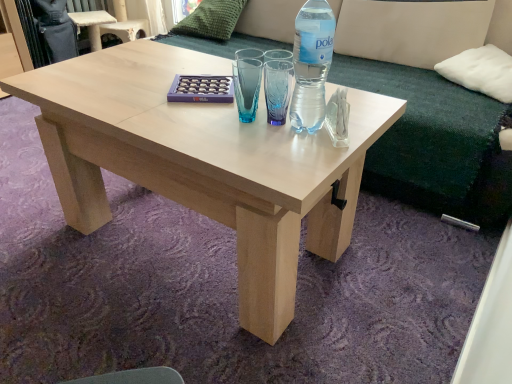
This screenshot has height=384, width=512. What are the coordinates of `white soft cushion at upper right, the first pillow positioned from the front` in the screenshot? It's located at (481, 71).

At what (x,y) coordinates should I click in order to perform the action: click on natural wood coffee table at center. Please return your answer as a coordinate pair (x, y). Looking at the image, I should click on (203, 162).

Identify the location of green textured pillow at upper center, the second pillow positioned from the front. (211, 20).

Describe the element at coordinates (435, 143) in the screenshot. I see `beige fabric couch at upper center` at that location.

This screenshot has height=384, width=512. What do you see at coordinates (311, 64) in the screenshot?
I see `clear plastic bottle at center` at bounding box center [311, 64].

Where is `clear plastic bottle at center`? This screenshot has width=512, height=384. clear plastic bottle at center is located at coordinates (311, 64).

This screenshot has width=512, height=384. Identify the location of white soft cushion at upper right, the 2th pillow positioned from the top. (481, 71).

Would you say clear plastic bottle at center is outside white soft cushion at upper right, the first pillow positioned from the front?

Absolutely, clear plastic bottle at center is external to white soft cushion at upper right, the first pillow positioned from the front.

Is clear plastic bottle at center bigger than white soft cushion at upper right, acting as the first pillow starting from the bottom?

Actually, clear plastic bottle at center might be smaller than white soft cushion at upper right, acting as the first pillow starting from the bottom.

From the image's perspective, relative to white soft cushion at upper right, which appears as the 1th pillow when viewed from the right, is clear plastic bottle at center above or below?

Clearly, from the image's perspective, clear plastic bottle at center is below white soft cushion at upper right, which appears as the 1th pillow when viewed from the right.

From the image's perspective, does beige fabric couch at upper center appear higher than white soft cushion at upper right, the 2th pillow positioned from the top?

Yes, from the image's perspective, beige fabric couch at upper center is on top of white soft cushion at upper right, the 2th pillow positioned from the top.

Can white soft cushion at upper right, which is the 2th pillow in left-to-right order, be found inside beige fabric couch at upper center?

Absolutely, white soft cushion at upper right, which is the 2th pillow in left-to-right order, is inside beige fabric couch at upper center.

Would you say beige fabric couch at upper center is to the left or to the right of white soft cushion at upper right, the 2th pillow positioned from the top, in the picture?

Clearly, beige fabric couch at upper center is on the left of white soft cushion at upper right, the 2th pillow positioned from the top, in the image.

Considering the positions of objects clear plastic bottle at center and green textured pillow at upper center, the second pillow positioned from the front, in the image provided, who is more to the right, clear plastic bottle at center or green textured pillow at upper center, the second pillow positioned from the front,?

Positioned to the right is clear plastic bottle at center.

Between clear plastic bottle at center and green textured pillow at upper center, the 1th pillow positioned from the back, which one has larger size?

green textured pillow at upper center, the 1th pillow positioned from the back.

Looking at their sizes, would you say clear plastic bottle at center is wider or thinner than green textured pillow at upper center, the 1th pillow positioned from the back?

Considering their sizes, clear plastic bottle at center looks slimmer than green textured pillow at upper center, the 1th pillow positioned from the back.

Is point (295, 130) positioned behind point (232, 32)?

No, (295, 130) is closer to viewer.

This screenshot has width=512, height=384. Find the location of `couch on the right of green textured pillow at upper center, the 1th pillow positioned from the back`. couch on the right of green textured pillow at upper center, the 1th pillow positioned from the back is located at coordinates [x=435, y=143].

How distant is green textured pillow at upper center, the 1th pillow positioned from the back, from beige fabric couch at upper center?

They are 39.10 inches apart.

Would you consider green textured pillow at upper center, the 2th pillow in the bottom-to-top sequence, to be distant from beige fabric couch at upper center?

Actually, green textured pillow at upper center, the 2th pillow in the bottom-to-top sequence, and beige fabric couch at upper center are a little close together.

In the scene shown: Between green textured pillow at upper center, arranged as the second pillow when viewed from the right, and beige fabric couch at upper center, which one has larger width?

Result: With larger width is beige fabric couch at upper center.

Does point (398, 150) come behind point (189, 192)?

Yes, it is behind point (189, 192).

Between beige fabric couch at upper center and natural wood coffee table at center, which one is positioned in front?

natural wood coffee table at center is closer to the camera.

Between beige fabric couch at upper center and natural wood coffee table at center, which one has smaller width?

Thinner between the two is beige fabric couch at upper center.

How different are the orientations of beige fabric couch at upper center and natural wood coffee table at center in degrees?

The facing directions of beige fabric couch at upper center and natural wood coffee table at center are 0.361 degrees apart.

From the image's perspective, which object appears higher, clear plastic bottle at center or natural wood coffee table at center?

From the image's view, clear plastic bottle at center is above.

Is the position of clear plastic bottle at center less distant than that of natural wood coffee table at center?

No, it is not.

Is the surface of clear plastic bottle at center in direct contact with natural wood coffee table at center?

No, clear plastic bottle at center is not with natural wood coffee table at center.

At what (x,y) coordinates should I click in order to perform the action: click on couch that appears on the right of green textured pillow at upper center, arranged as the second pillow when viewed from the right. Please return your answer as a coordinate pair (x, y). This screenshot has height=384, width=512. Looking at the image, I should click on (435, 143).

Does beige fabric couch at upper center lie in front of green textured pillow at upper center, arranged as the second pillow when viewed from the right?

Yes.

From the image's perspective, who appears lower, beige fabric couch at upper center or green textured pillow at upper center, the second pillow positioned from the front?

beige fabric couch at upper center appears lower in the image.

Image resolution: width=512 pixels, height=384 pixels. I want to click on bottle to the left of white soft cushion at upper right, which appears as the 1th pillow when viewed from the right, so click(x=311, y=64).

From a real-world perspective, count 1st pillows upward from the beige fabric couch at upper center and point to it. Please provide its 2D coordinates.

[(481, 71)]

Which object lies further to the anchor point green textured pillow at upper center, the second pillow positioned from the front, natural wood coffee table at center or white soft cushion at upper right, the first pillow positioned from the front?

The object further to green textured pillow at upper center, the second pillow positioned from the front, is white soft cushion at upper right, the first pillow positioned from the front.

Estimate the real-world distances between objects in this image. Which object is further from natural wood coffee table at center, clear plastic bottle at center or white soft cushion at upper right, the 2th pillow positioned from the top?

Based on the image, white soft cushion at upper right, the 2th pillow positioned from the top, appears to be further to natural wood coffee table at center.

Considering their positions, is white soft cushion at upper right, which appears as the 1th pillow when viewed from the right, positioned further to natural wood coffee table at center than clear plastic bottle at center?

The object further to natural wood coffee table at center is white soft cushion at upper right, which appears as the 1th pillow when viewed from the right.

In the scene shown: Which object lies nearer to the anchor point green textured pillow at upper center, acting as the 1th pillow starting from the left, beige fabric couch at upper center or natural wood coffee table at center?

Based on the image, beige fabric couch at upper center appears to be nearer to green textured pillow at upper center, acting as the 1th pillow starting from the left.

From the image, which object appears to be nearer to clear plastic bottle at center, natural wood coffee table at center or white soft cushion at upper right, which appears as the 1th pillow when viewed from the right?

natural wood coffee table at center is closer to clear plastic bottle at center.

Considering their positions, is natural wood coffee table at center positioned further to green textured pillow at upper center, the second pillow positioned from the front, than beige fabric couch at upper center?

natural wood coffee table at center is further to green textured pillow at upper center, the second pillow positioned from the front.

Based on their spatial positions, is white soft cushion at upper right, the first pillow positioned from the front, or natural wood coffee table at center further from clear plastic bottle at center?

white soft cushion at upper right, the first pillow positioned from the front.

Considering their positions, is natural wood coffee table at center positioned closer to green textured pillow at upper center, arranged as the second pillow when viewed from the right, than clear plastic bottle at center?

The object closer to green textured pillow at upper center, arranged as the second pillow when viewed from the right, is natural wood coffee table at center.

This screenshot has height=384, width=512. In order to click on bottle located between natural wood coffee table at center and beige fabric couch at upper center in the left-right direction in this screenshot , I will do `click(311, 64)`.

Locate an element on the screen. The image size is (512, 384). couch located between clear plastic bottle at center and green textured pillow at upper center, acting as the 1th pillow starting from the left, in the depth direction is located at coordinates (435, 143).

The height and width of the screenshot is (384, 512). Find the location of `couch situated between clear plastic bottle at center and white soft cushion at upper right, which appears as the 1th pillow when viewed from the right, from left to right`. couch situated between clear plastic bottle at center and white soft cushion at upper right, which appears as the 1th pillow when viewed from the right, from left to right is located at coordinates tap(435, 143).

What are the coordinates of `couch between green textured pillow at upper center, the 1th pillow positioned from the back, and white soft cushion at upper right, acting as the first pillow starting from the bottom, from left to right` in the screenshot? It's located at (435, 143).